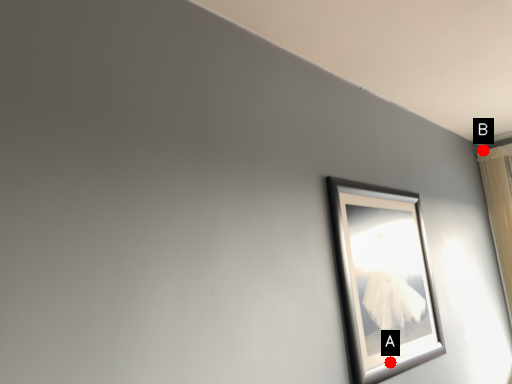
Question: Two points are circled on the image, labeled by A and B beside each circle. Which point is closer to the camera?

Choices:
 (A) A is closer
 (B) B is closer

Answer: (A)